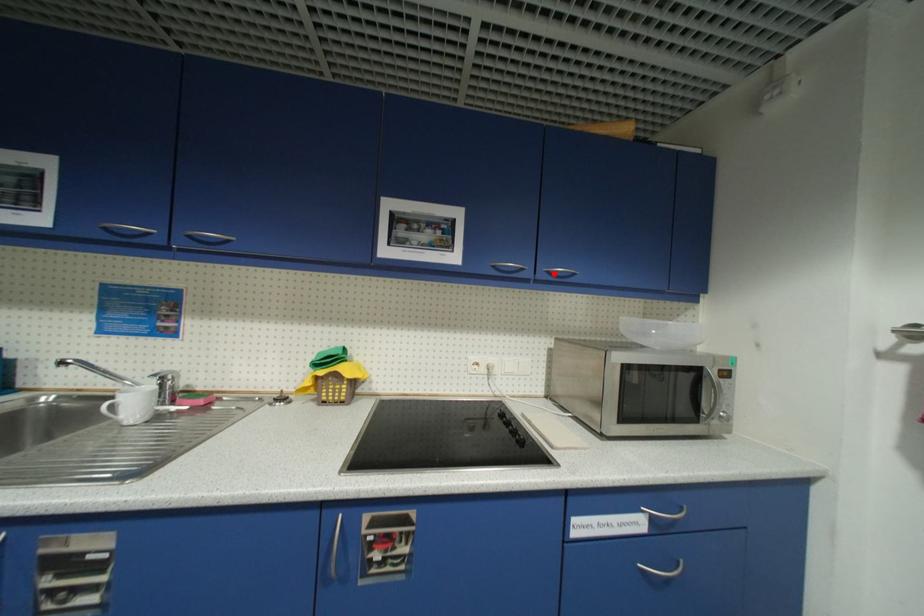
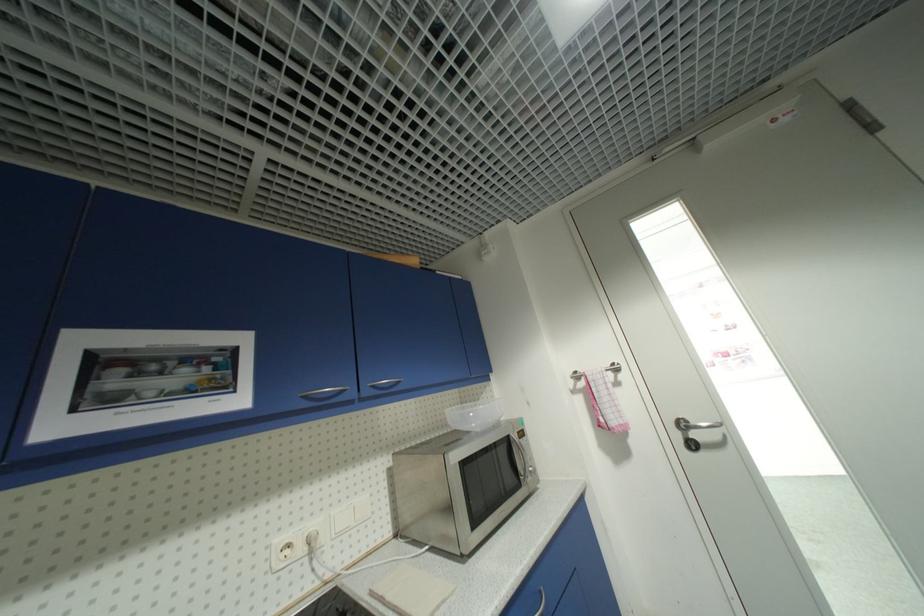
Where in the second image is the point corresponding to the highlighted location from the first image?

(379, 387)